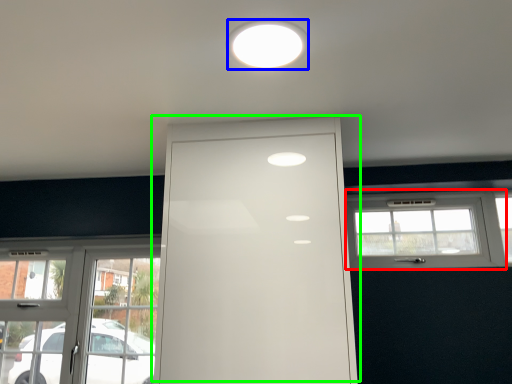
Question: Considering the real-world distances, which object is farthest from window (highlighted by a red box)? lighting (highlighted by a blue box) or door (highlighted by a green box)?

Choices:
 (A) lighting
 (B) door

Answer: (A)